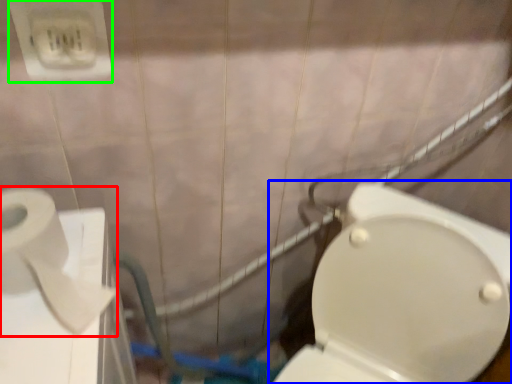
Question: Which object is the closest to the toilet paper (highlighted by a red box)? Choose among these: toilet (highlighted by a blue box) or electric outlet (highlighted by a green box).

Choices:
 (A) toilet
 (B) electric outlet

Answer: (B)